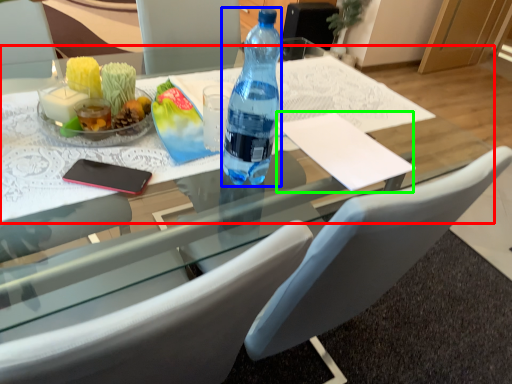
Question: Which object is positioned closest to round table (highlighted by a red box)? Select from bottle (highlighted by a blue box) and notepad (highlighted by a green box).

Choices:
 (A) bottle
 (B) notepad

Answer: (B)